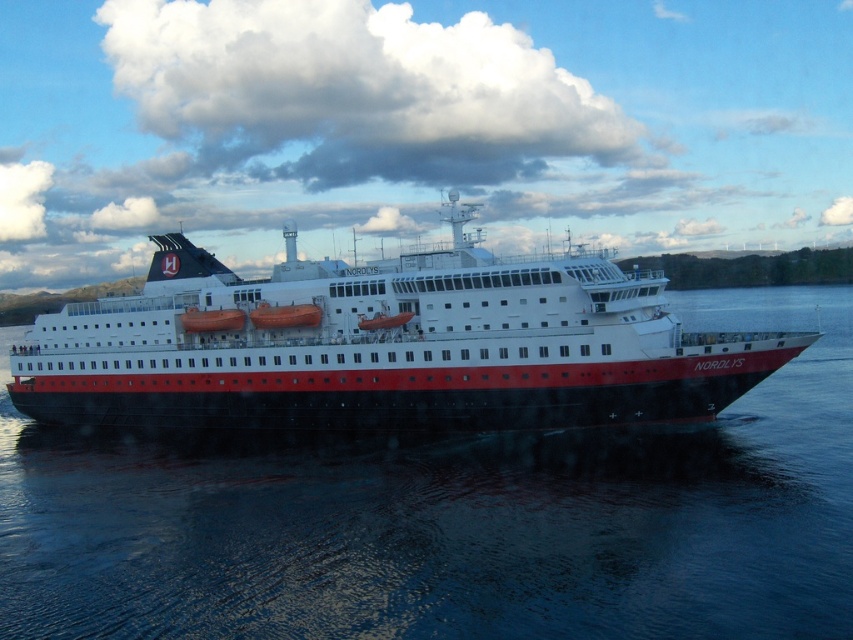
Question: Is black water at center bigger than polished steel ship at center?

Choices:
 (A) no
 (B) yes

Answer: (A)

Question: Can you confirm if black water at center is thinner than polished steel ship at center?

Choices:
 (A) yes
 (B) no

Answer: (B)

Question: Which point appears closest to the camera in this image?

Choices:
 (A) (315, 476)
 (B) (465, 380)

Answer: (A)

Question: Is black water at center thinner than polished steel ship at center?

Choices:
 (A) no
 (B) yes

Answer: (A)